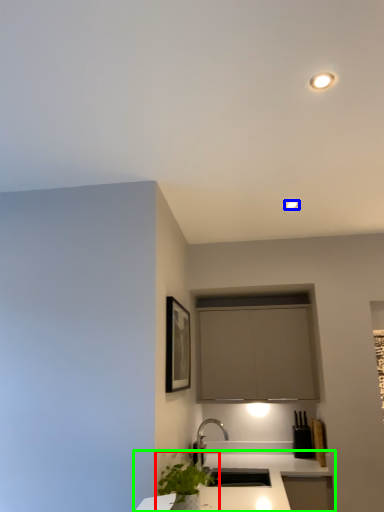
Question: Based on their relative distances, which object is farther from houseplant (highlighted by a red box)? Choose from light fixture (highlighted by a blue box) and countertop (highlighted by a green box).

Choices:
 (A) light fixture
 (B) countertop

Answer: (A)